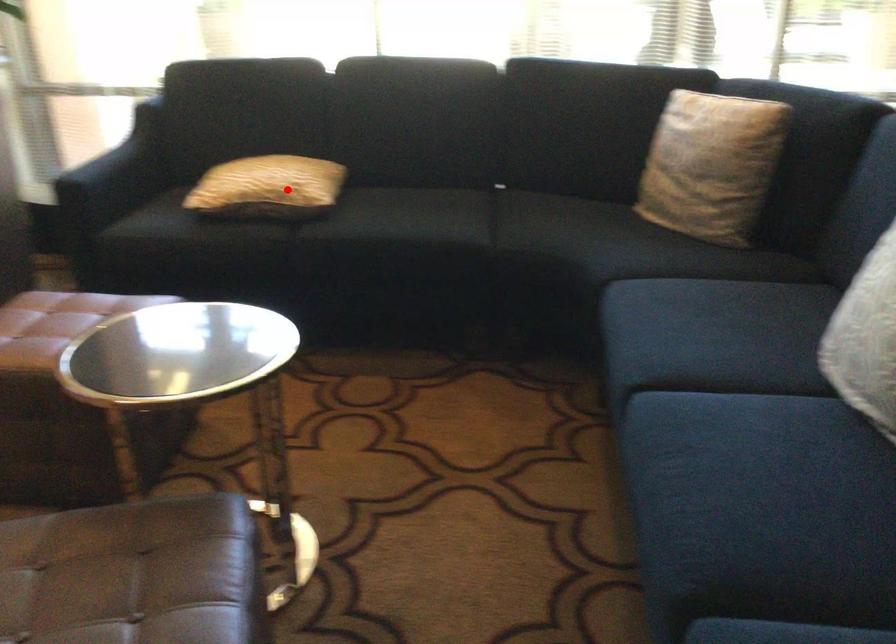
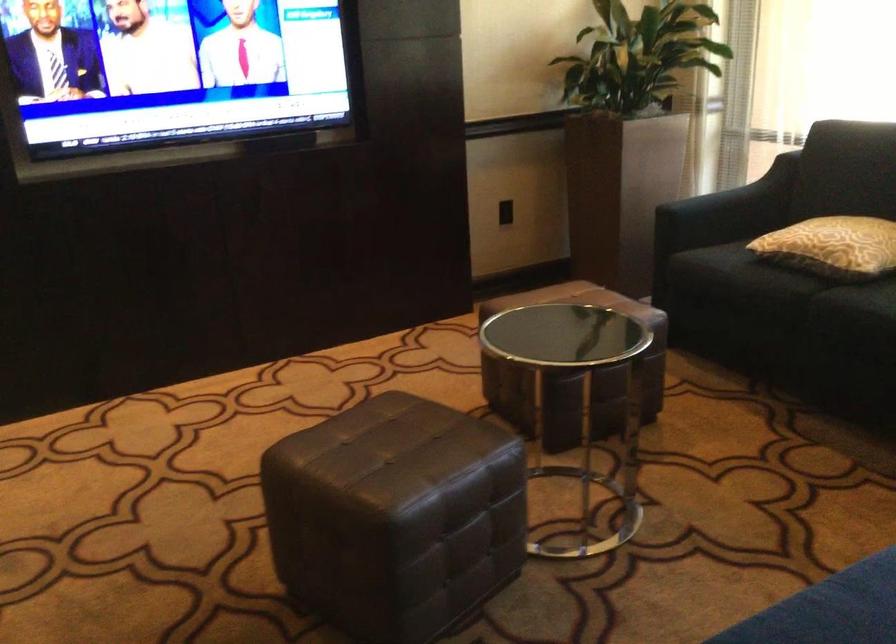
Find the pixel in the second image that matches the highlighted location in the first image.

(832, 245)